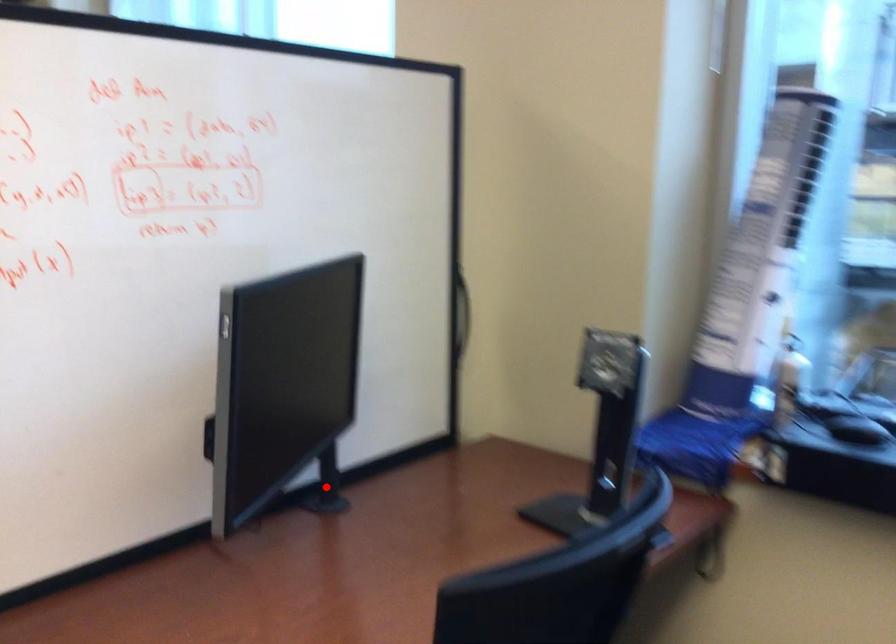
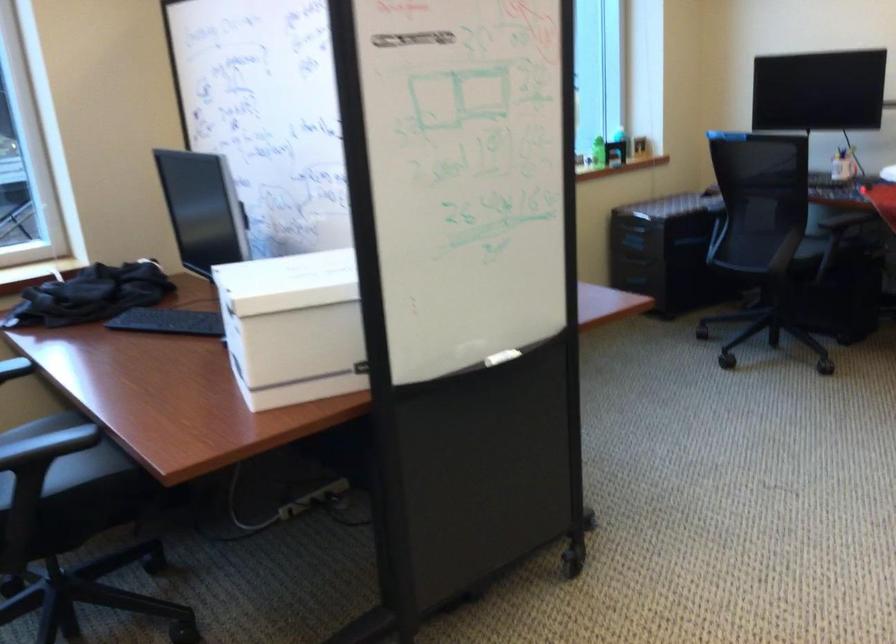
Question: I am providing you with two images of the same scene from different viewpoints. A red point is marked on the first image. Is the red point's position out of view in image 2?

Choices:
 (A) Yes
 (B) No

Answer: (A)